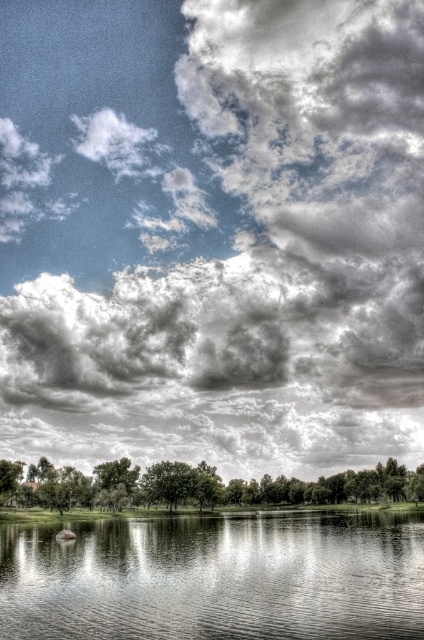
From the picture: Is cloudy sky at upper center positioned behind green leafy tree at center?

Yes, cloudy sky at upper center is behind green leafy tree at center.

Who is more distant from viewer, (125, 42) or (2, 464)?

Point (125, 42)

Which is behind, point (312, 429) or point (206, 464)?

The point (312, 429) is behind.

The height and width of the screenshot is (640, 424). What are the coordinates of `cloudy sky at upper center` in the screenshot? It's located at (212, 232).

Is cloudy sky at upper center smaller than transparent water at center?

No.

Which is below, cloudy sky at upper center or transparent water at center?

Positioned lower is transparent water at center.

The width and height of the screenshot is (424, 640). Describe the element at coordinates (212, 232) in the screenshot. I see `cloudy sky at upper center` at that location.

Identify the location of cloudy sky at upper center. (212, 232).

Can you confirm if transparent water at center is positioned to the left of green leafy tree at center?

Yes, transparent water at center is to the left of green leafy tree at center.

Is transparent water at center taller than green leafy tree at center?

No.

Which is in front, point (61, 616) or point (270, 499)?

Point (61, 616) is in front.

Locate an element on the screen. transparent water at center is located at coordinates (217, 577).